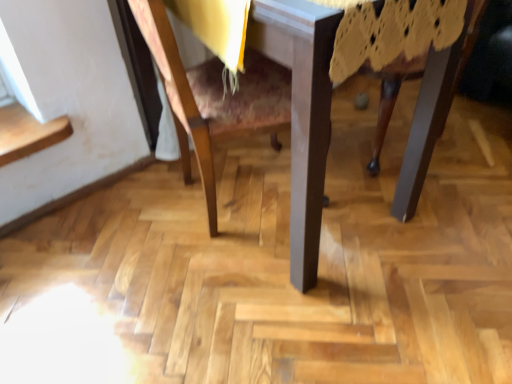
Question: Is wooden table at center at the left side of wooden chair at center?

Choices:
 (A) no
 (B) yes

Answer: (A)

Question: Does wooden table at center have a smaller size compared to wooden chair at center?

Choices:
 (A) no
 (B) yes

Answer: (A)

Question: Is the depth of wooden table at center less than that of wooden chair at center?

Choices:
 (A) yes
 (B) no

Answer: (A)

Question: Is wooden table at center positioned beyond the bounds of wooden chair at center?

Choices:
 (A) no
 (B) yes

Answer: (A)

Question: Could you tell me if wooden table at center is turned towards wooden chair at center?

Choices:
 (A) yes
 (B) no

Answer: (A)

Question: Is wooden table at center positioned far away from wooden chair at center?

Choices:
 (A) yes
 (B) no

Answer: (B)

Question: Would you consider wooden chair at center to be distant from wooden table at center?

Choices:
 (A) no
 (B) yes

Answer: (A)

Question: Can you confirm if wooden chair at center is positioned to the right of wooden table at center?

Choices:
 (A) no
 (B) yes

Answer: (A)

Question: Could you tell me if wooden chair at center is turned towards wooden table at center?

Choices:
 (A) yes
 (B) no

Answer: (A)

Question: Is wooden chair at center thinner than wooden table at center?

Choices:
 (A) no
 (B) yes

Answer: (B)

Question: Is wooden chair at center bigger than wooden table at center?

Choices:
 (A) yes
 (B) no

Answer: (B)

Question: Does wooden chair at center touch wooden table at center?

Choices:
 (A) yes
 (B) no

Answer: (A)

Question: Relative to wooden table at center, is wooden chair at center in front or behind?

Choices:
 (A) behind
 (B) front

Answer: (A)